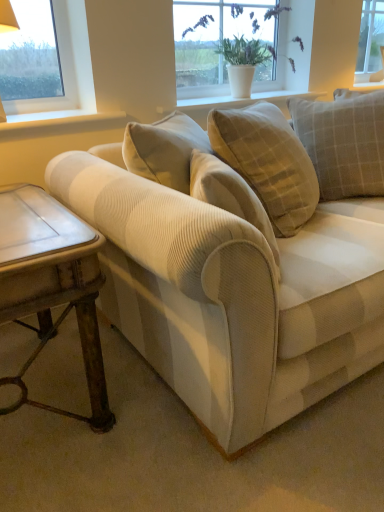
Question: From a real-world perspective, is rustic wood side table at lower left above or below beige corduroy couch at center?

Choices:
 (A) above
 (B) below

Answer: (B)

Question: In terms of size, does rustic wood side table at lower left appear bigger or smaller than beige corduroy couch at center?

Choices:
 (A) small
 (B) big

Answer: (A)

Question: Estimate the real-world distances between objects in this image. Which object is closer to the beige corduroy pillow at center, positioned as the 2th pillow in right-to-left order?

Choices:
 (A) rustic wood side table at lower left
 (B) white wood at upper center, the first window sill when ordered from left to right
 (C) clear glass window at upper right, positioned as the 1th window in right-to-left order
 (D) white ceramic pot at upper center, the first window from the front
 (E) white textured vase at upper center, arranged as the 1th window sill when viewed from the top

Answer: (E)

Question: Considering the real-world distances, which object is closest to the rustic wood side table at lower left?

Choices:
 (A) white textured vase at upper center, which is the first window sill in right-to-left order
 (B) light beige corduroy pillow at upper right, which is the 1th pillow from right to left
 (C) beige corduroy couch at center
 (D) white ceramic pot at upper center, the first window from the front
 (E) white wood at upper center, the second window sill in the back-to-front sequence

Answer: (C)